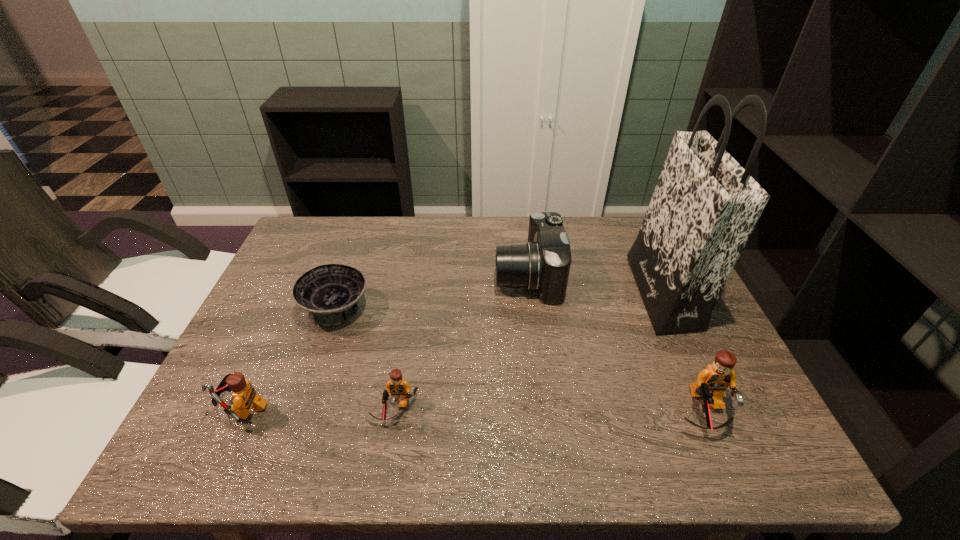
The image size is (960, 540). In order to click on shopping bag that is at the right edge in this screenshot , I will do `click(705, 205)`.

The width and height of the screenshot is (960, 540). Find the location of `object situated at the near left corner`. object situated at the near left corner is located at coordinates point(244,396).

In order to click on object at the far right corner in this screenshot , I will do `click(705, 205)`.

The image size is (960, 540). In order to click on object that is at the near right corner in this screenshot , I will do `click(712, 382)`.

In the image, there is a desktop. Identify the location of vacant space at the far edge. This screenshot has width=960, height=540. (519, 225).

Where is `vacant space at the near edge of the desktop`? Image resolution: width=960 pixels, height=540 pixels. vacant space at the near edge of the desktop is located at coordinates (570, 392).

Find the location of `free space at the far left corner`. free space at the far left corner is located at coordinates (313, 224).

In the image, there is a desktop. At what (x,y) coordinates should I click in order to perform the action: click on vacant space at the near right corner. Please return your answer as a coordinate pair (x, y). Looking at the image, I should click on (696, 401).

You are a GUI agent. You are given a task and a screenshot of the screen. Output one action in this format:
    pyautogui.click(x=<x>, y=<y>)
    Task: Click on the free point between the tallest Lego and the bowl
    
    Given the screenshot: What is the action you would take?
    pyautogui.click(x=520, y=361)

I want to click on vacant region between the tallest object and the fourth tallest object, so click(x=452, y=350).